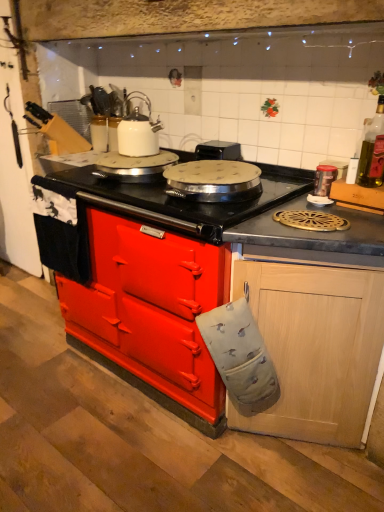
Question: Would you say black plastic toaster at upper center contains metallic silver canister at upper right, marked as the 1th kitchen appliance in a bottom-to-top arrangement?

Choices:
 (A) yes
 (B) no

Answer: (B)

Question: Considering the relative positions of black plastic toaster at upper center and metallic silver canister at upper right, the second kitchen appliance in the left-to-right sequence, in the image provided, is black plastic toaster at upper center to the left of metallic silver canister at upper right, the second kitchen appliance in the left-to-right sequence, from the viewer's perspective?

Choices:
 (A) no
 (B) yes

Answer: (B)

Question: From a real-world perspective, is black plastic toaster at upper center over metallic silver canister at upper right, the first kitchen appliance viewed from the front?

Choices:
 (A) yes
 (B) no

Answer: (A)

Question: Is the surface of black plastic toaster at upper center in direct contact with metallic silver canister at upper right, which ranks as the 1th kitchen appliance in right-to-left order?

Choices:
 (A) no
 (B) yes

Answer: (A)

Question: Can you confirm if black plastic toaster at upper center is smaller than metallic silver canister at upper right, placed as the second kitchen appliance when sorted from top to bottom?

Choices:
 (A) yes
 (B) no

Answer: (B)

Question: From a real-world perspective, is black plastic toaster at upper center positioned above or below metallic silver canister at upper right, the second kitchen appliance in the left-to-right sequence?

Choices:
 (A) below
 (B) above

Answer: (B)

Question: From the image's perspective, relative to metallic silver canister at upper right, marked as the 1th kitchen appliance in a bottom-to-top arrangement, is black plastic toaster at upper center above or below?

Choices:
 (A) above
 (B) below

Answer: (A)

Question: Is point (220, 158) closer or farther from the camera than point (322, 195)?

Choices:
 (A) closer
 (B) farther

Answer: (B)

Question: In terms of height, does black plastic toaster at upper center look taller or shorter compared to metallic silver canister at upper right, which ranks as the 1th kitchen appliance in right-to-left order?

Choices:
 (A) short
 (B) tall

Answer: (A)

Question: In the image, is metallic silver canister at upper right, the 2th kitchen appliance from the back, on the left side or the right side of black matte countertop at center?

Choices:
 (A) right
 (B) left

Answer: (A)

Question: Considering the positions of metallic silver canister at upper right, placed as the second kitchen appliance when sorted from top to bottom, and black matte countertop at center in the image, is metallic silver canister at upper right, placed as the second kitchen appliance when sorted from top to bottom, wider or thinner than black matte countertop at center?

Choices:
 (A) wide
 (B) thin

Answer: (B)

Question: Is metallic silver canister at upper right, placed as the second kitchen appliance when sorted from top to bottom, inside or outside of black matte countertop at center?

Choices:
 (A) outside
 (B) inside

Answer: (A)

Question: From the image's perspective, is metallic silver canister at upper right, placed as the second kitchen appliance when sorted from top to bottom, above or below black matte countertop at center?

Choices:
 (A) above
 (B) below

Answer: (A)

Question: In the image, is black plastic toaster at upper center positioned in front of or behind white glossy kettle at upper center, the 1th kitchen appliance positioned from the back?

Choices:
 (A) front
 (B) behind

Answer: (B)

Question: In terms of width, does black plastic toaster at upper center look wider or thinner when compared to white glossy kettle at upper center, the second kitchen appliance positioned from the front?

Choices:
 (A) thin
 (B) wide

Answer: (B)